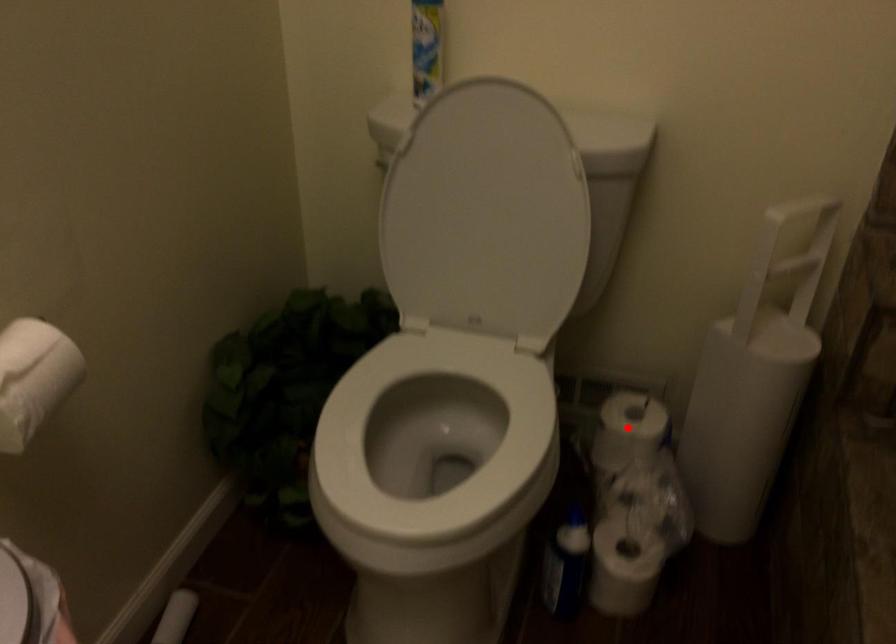
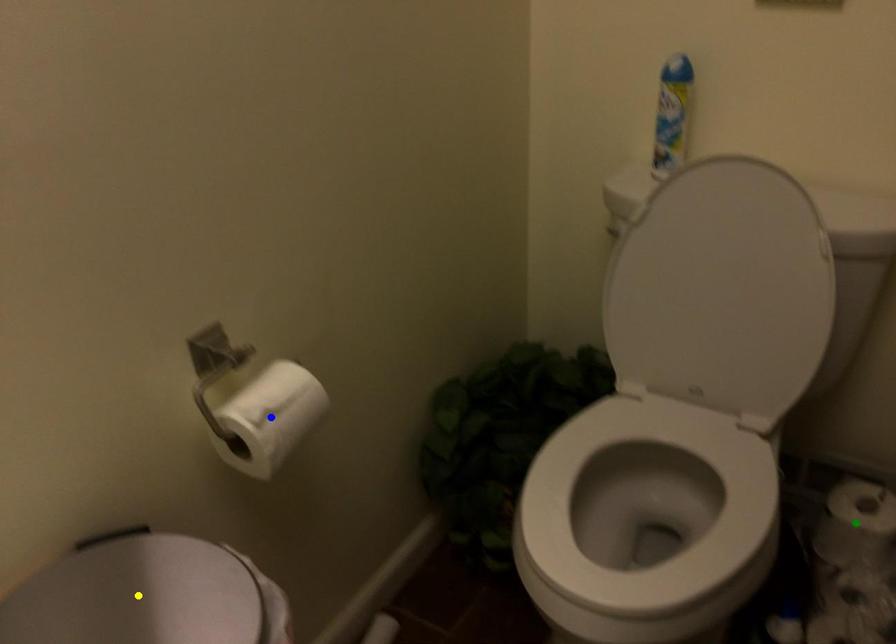
Question: I am providing you with two images of the same scene from different viewpoints. A red point is marked on the first image. You are given multiple points on the second image. Which point in image 2 is actually the same real-world point as the red point in image 1?

Choices:
 (A) yellow point
 (B) green point
 (C) blue point

Answer: (B)